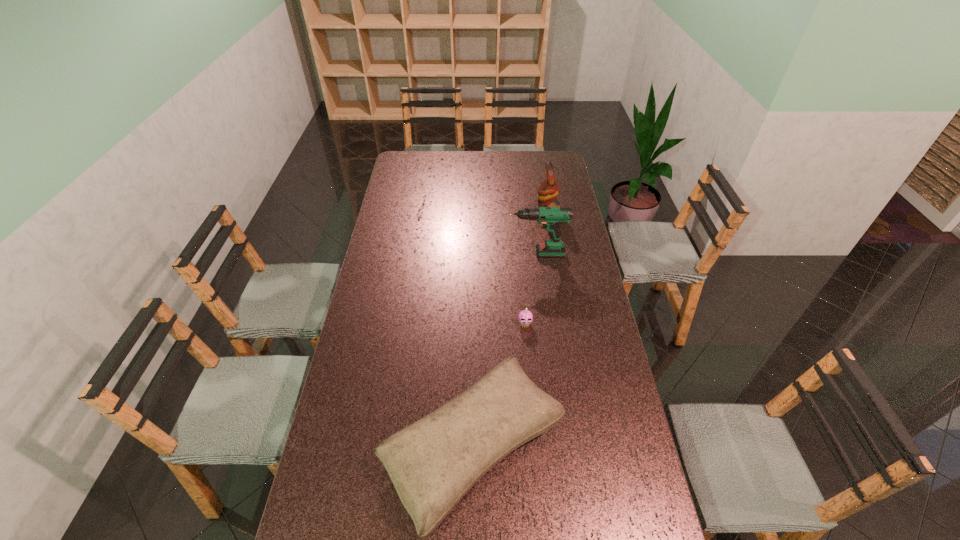
This screenshot has width=960, height=540. Find the location of `empty location between the second farthest object and the farthest object`. empty location between the second farthest object and the farthest object is located at coordinates (540, 232).

Find the location of `object that stands as the third closest to the shortest object`. object that stands as the third closest to the shortest object is located at coordinates (549, 189).

Select which object appears as the second closest to the parrot. Please provide its 2D coordinates. Your answer should be formatted as a tuple, i.e. [(x, y)], where the tuple contains the x and y coordinates of a point satisfying the conditions above.

[(525, 317)]

Where is `free space that satisfies the following two spatial constraints: 1. on the handle side of the third nearest object; 2. on the face of the cupcake`? free space that satisfies the following two spatial constraints: 1. on the handle side of the third nearest object; 2. on the face of the cupcake is located at coordinates (542, 324).

Locate an element on the screen. vacant region that satisfies the following two spatial constraints: 1. on the handle side of the drill; 2. on the face of the shortest object is located at coordinates (542, 324).

At what (x,y) coordinates should I click in order to perform the action: click on vacant region that satisfies the following two spatial constraints: 1. on the handle side of the second farthest object; 2. on the face of the shortest object. Please return your answer as a coordinate pair (x, y). The width and height of the screenshot is (960, 540). Looking at the image, I should click on (542, 324).

I want to click on vacant space that satisfies the following two spatial constraints: 1. on the handle side of the second farthest object; 2. on the face of the shortest object, so click(542, 324).

The width and height of the screenshot is (960, 540). In order to click on free point that satisfies the following two spatial constraints: 1. on the handle side of the second farthest object; 2. on the face of the second nearest object in this screenshot , I will do `click(542, 324)`.